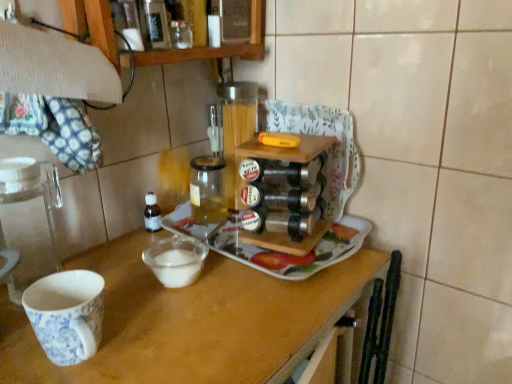
Question: Would you say translucent glass jar at center contains white ceramic tray at center?

Choices:
 (A) yes
 (B) no

Answer: (B)

Question: Can you confirm if translucent glass jar at center is thinner than white ceramic tray at center?

Choices:
 (A) no
 (B) yes

Answer: (B)

Question: Can you confirm if translucent glass jar at center is positioned to the right of white ceramic tray at center?

Choices:
 (A) yes
 (B) no

Answer: (B)

Question: Considering the relative sizes of translucent glass jar at center and white ceramic tray at center in the image provided, is translucent glass jar at center shorter than white ceramic tray at center?

Choices:
 (A) no
 (B) yes

Answer: (A)

Question: Does translucent glass jar at center appear on the left side of white ceramic tray at center?

Choices:
 (A) no
 (B) yes

Answer: (B)

Question: From a real-world perspective, relative to white ceramic tray at center, is wooden table at center vertically above or below?

Choices:
 (A) above
 (B) below

Answer: (B)

Question: From the image's perspective, is wooden table at center above or below white ceramic tray at center?

Choices:
 (A) below
 (B) above

Answer: (A)

Question: Is wooden table at center situated inside white ceramic tray at center or outside?

Choices:
 (A) outside
 (B) inside

Answer: (A)

Question: Would you say wooden table at center is to the left or to the right of white ceramic tray at center in the picture?

Choices:
 (A) right
 (B) left

Answer: (B)

Question: From the image's perspective, is translucent glass jar at center positioned above or below white ceramic tray at center?

Choices:
 (A) below
 (B) above

Answer: (B)

Question: Based on their positions, is translucent glass jar at center located to the left or right of white ceramic tray at center?

Choices:
 (A) left
 (B) right

Answer: (A)

Question: Considering the positions of translucent glass jar at center and white ceramic tray at center in the image, is translucent glass jar at center wider or thinner than white ceramic tray at center?

Choices:
 (A) wide
 (B) thin

Answer: (B)

Question: In the image, is translucent glass jar at center positioned in front of or behind white ceramic tray at center?

Choices:
 (A) front
 (B) behind

Answer: (B)

Question: Looking at their shapes, would you say translucent glass jar at center is wider or thinner than wooden table at center?

Choices:
 (A) wide
 (B) thin

Answer: (B)

Question: From a real-world perspective, relative to wooden table at center, is translucent glass jar at center vertically above or below?

Choices:
 (A) above
 (B) below

Answer: (A)